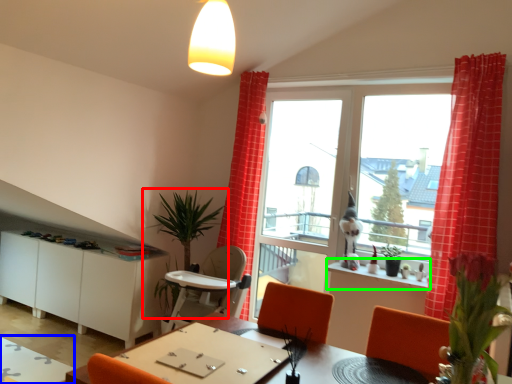
Question: Based on their relative distances, which object is farther from houseplant (highlighted by a red box)? Choose from table (highlighted by a blue box) and window sill (highlighted by a green box).

Choices:
 (A) table
 (B) window sill

Answer: (A)